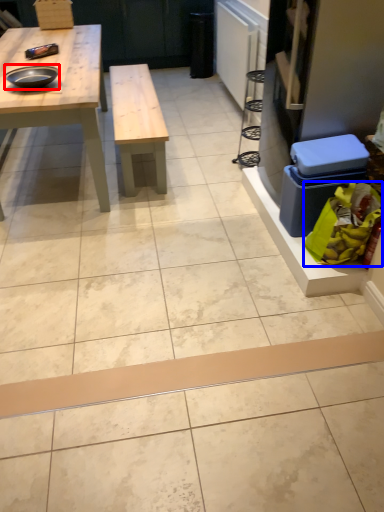
Question: Which object appears farthest to the camera in this image, tray (highlighted by a red box) or food (highlighted by a blue box)?

Choices:
 (A) tray
 (B) food

Answer: (A)